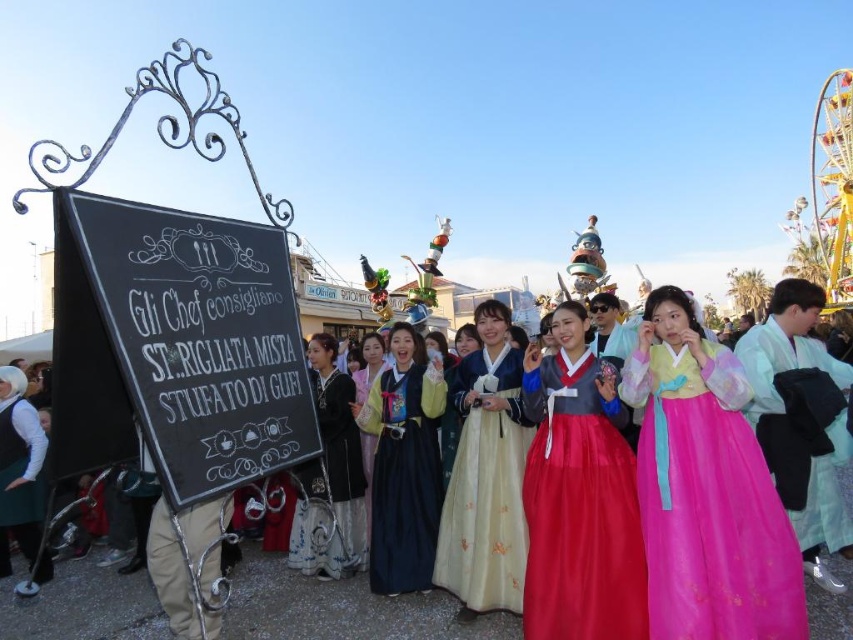
Based on the photo, you are a festival attendee who wants to move from the black chalkboard at left to the light blue silk kimono at center. Can you walk directly between them without any obstacles?

The distance between the black chalkboard at left and the light blue silk kimono at center is 52.25 meters. Since there are no mentioned obstacles in the scene description, you can walk directly between them.

You are a photographer at the event and want to position yourself to capture the pink satin dress at center in the best possible way. Where should you stand relative to the dress to ensure it is centered in your frame?

To center the pink satin dress at center in your frame, you should position yourself directly in front of it along the line extending from its 2D coordinates at point (709, 502).